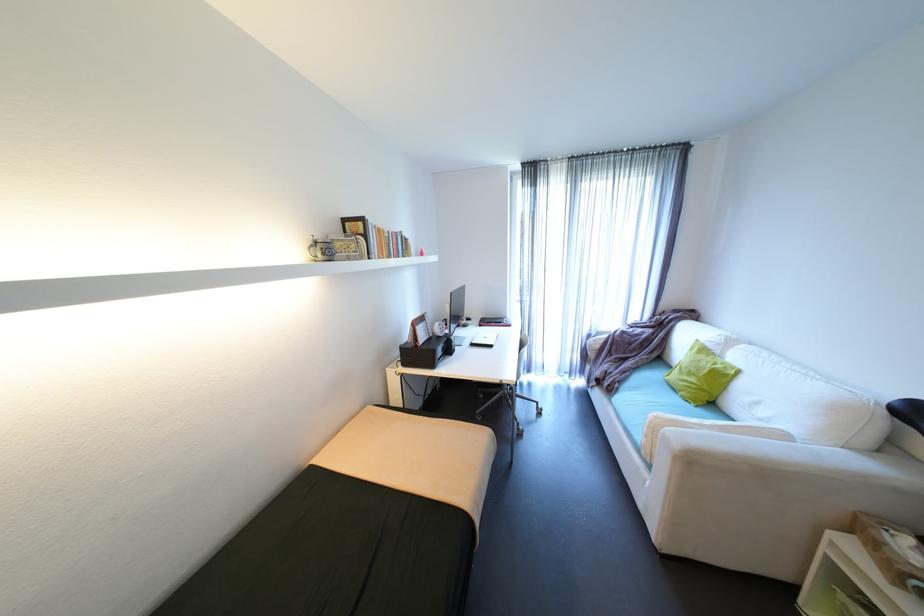
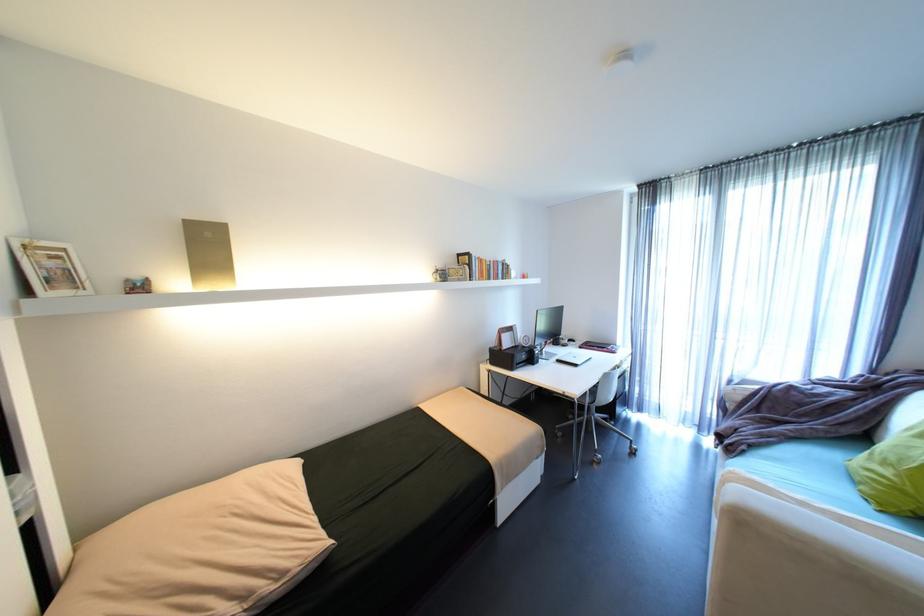
Where in the second image is the point corresponding to point 476,347 from the first image?

(562, 363)